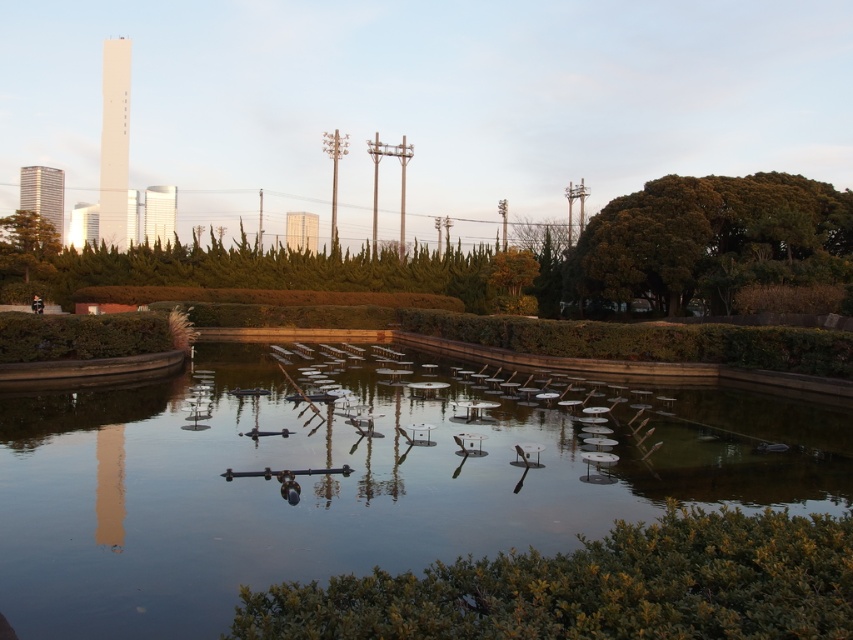
Question: Which object is closer to the camera taking this photo?

Choices:
 (A) transparent glass water at center
 (B) smooth glass skyscraper at upper left
 (C) smooth glass tower at upper center
 (D) white glossy tower at center

Answer: (A)

Question: Based on their relative distances, which object is nearer to the shiny glass skyscraper at upper left?

Choices:
 (A) transparent glass water at center
 (B) smooth glass tower at upper center
 (C) white glossy tower at center
 (D) smooth glass skyscraper at upper left

Answer: (B)

Question: Which of the following is the closest to the observer?

Choices:
 (A) smooth glass tower at upper center
 (B) white glossy tower at center
 (C) transparent glass water at center

Answer: (C)

Question: Can you confirm if green leafy tree at upper right is smaller than smooth glass tower at upper center?

Choices:
 (A) no
 (B) yes

Answer: (B)

Question: Where is transparent glass water at center located in relation to green leafy tree at upper right in the image?

Choices:
 (A) below
 (B) above

Answer: (A)

Question: Is green leafy tree at upper right wider than shiny glass skyscraper at upper left?

Choices:
 (A) yes
 (B) no

Answer: (B)